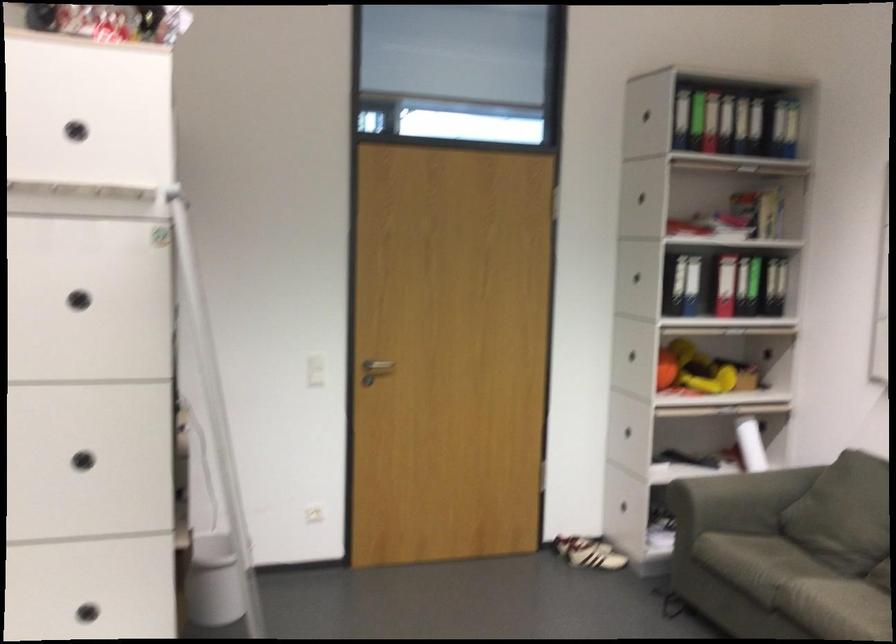
This screenshot has width=896, height=644. I want to click on sofa armrest, so click(x=771, y=623).